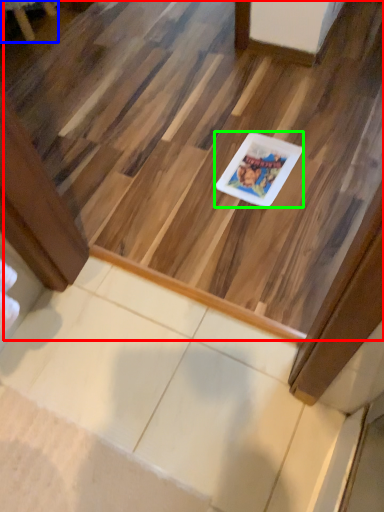
Question: Which object is the closest to the stairwell (highlighted by a red box)? Choose among these: furniture (highlighted by a blue box) or glass plate (highlighted by a green box).

Choices:
 (A) furniture
 (B) glass plate

Answer: (B)